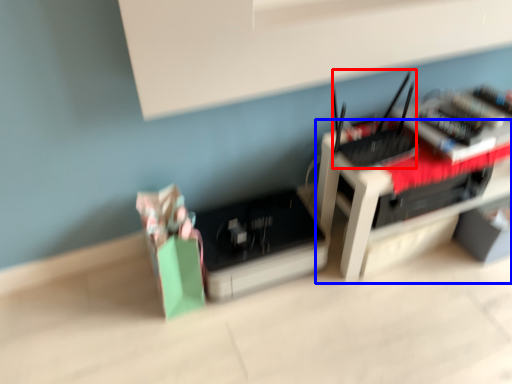
Question: Which point is closer to the camera, register (highlighted by a red box) or furniture (highlighted by a blue box)?

Choices:
 (A) register
 (B) furniture

Answer: (A)